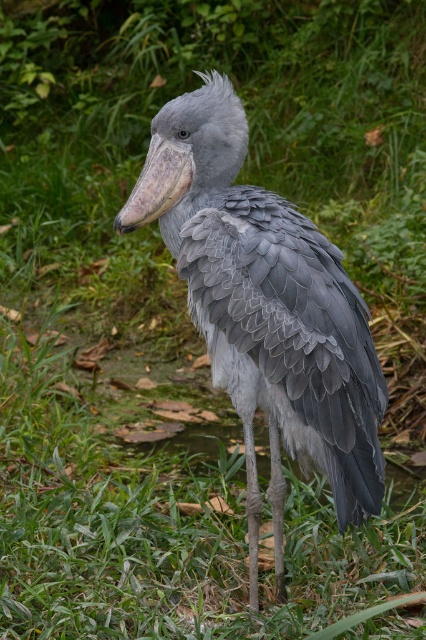
You are a wildlife photographer trying to capture a clear photo of the gray feathered bird at center and the gray matte beak at center. Which object should you focus on first if you want to ensure both are in focus without adjusting the camera settings?

The gray feathered bird at center is wider than the gray matte beak at center, so you should focus on the wider object first to ensure both are in focus.

You are a wildlife photographer trying to capture a clear shot of the gray feathered bird at center. You notice a point marked at coordinates (264, 308). Where is this point located in relation to the bird?

The point at coordinates (264, 308) is located on the gray feathered bird at center, as indicated by the description.